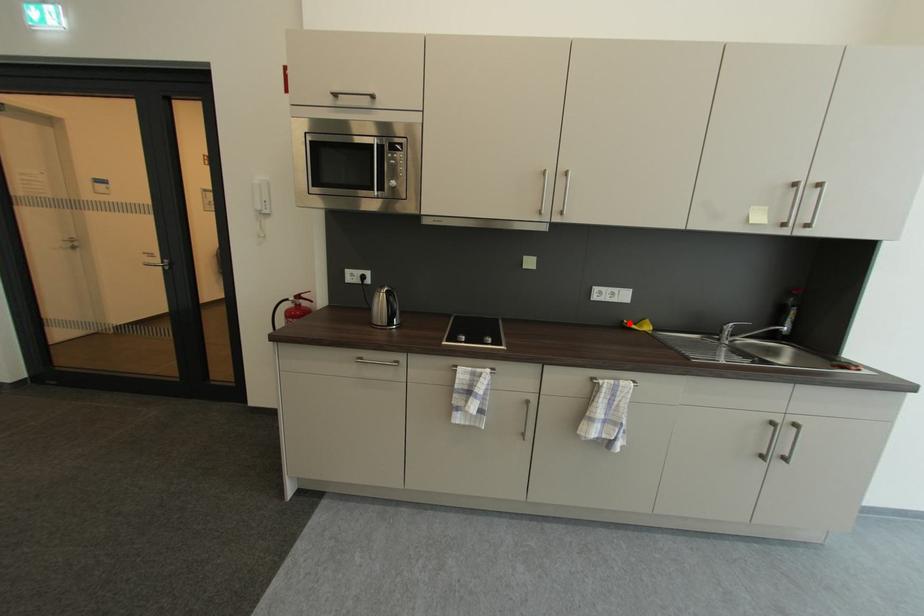
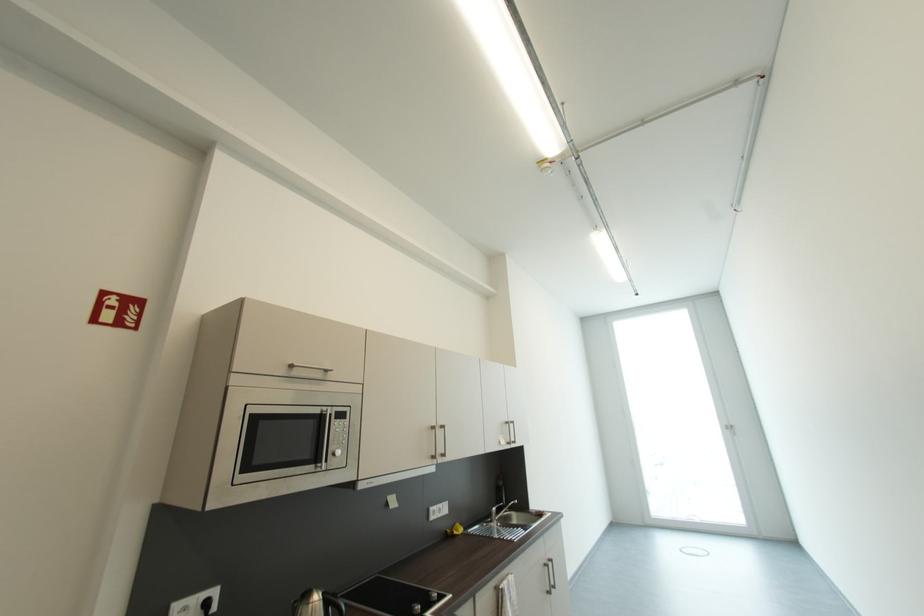
Locate, in the second image, the point that corresponds to the highlighted location in the first image.

(454, 533)